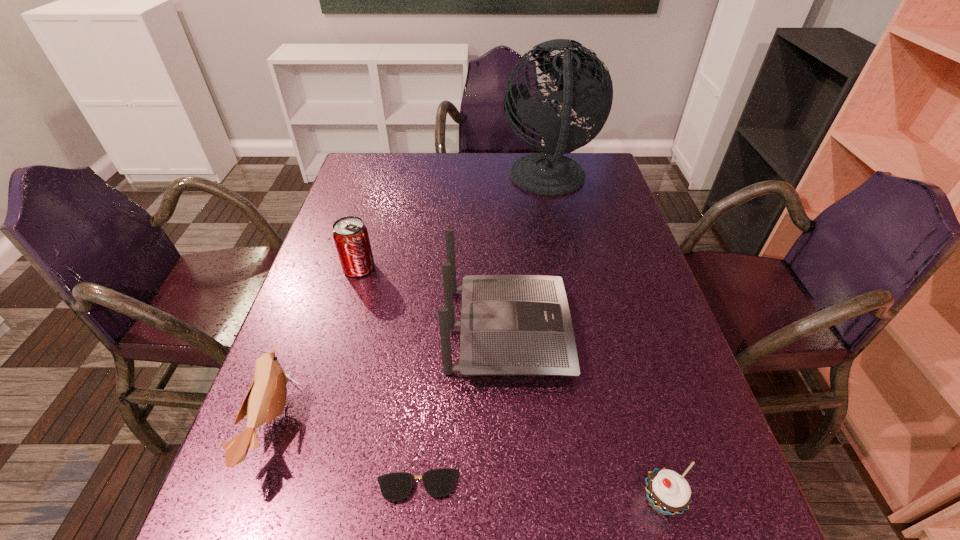
Where is `vacant point located between the cupcake and the shortest object`? The height and width of the screenshot is (540, 960). vacant point located between the cupcake and the shortest object is located at coordinates (540, 494).

In order to click on free space that is in between the tallest object and the leftmost object in this screenshot , I will do `click(411, 302)`.

Where is `vacant area that lies between the fifth tallest object and the spectacles`? This screenshot has width=960, height=540. vacant area that lies between the fifth tallest object and the spectacles is located at coordinates [540, 494].

Identify the location of free area in between the second shortest object and the shortest object. (540, 494).

This screenshot has width=960, height=540. I want to click on empty location between the bird and the spectacles, so click(346, 455).

Where is `free area in between the fifth tallest object and the spectacles`? The height and width of the screenshot is (540, 960). free area in between the fifth tallest object and the spectacles is located at coordinates (540, 494).

You are a GUI agent. You are given a task and a screenshot of the screen. Output one action in this format:
    pyautogui.click(x=<x>, y=<y>)
    Task: Click on the object that is the fifth closest to the shortest object
    The image size is (960, 540).
    Given the screenshot: What is the action you would take?
    pyautogui.click(x=587, y=85)

Select which object is the third closest to the spectacles. Please provide its 2D coordinates. Your answer should be formatted as a tuple, i.e. [(x, y)], where the tuple contains the x and y coordinates of a point satisfying the conditions above.

[(668, 493)]

Identify the location of free location that satisfies the following two spatial constraints: 1. on the back side of the shortest object; 2. on the front-facing side of the second tallest object. This screenshot has width=960, height=540. pyautogui.click(x=433, y=330).

The width and height of the screenshot is (960, 540). Identify the location of blank area in the image that satisfies the following two spatial constraints: 1. on the front-facing side of the tallest object; 2. on the front side of the pop soda. (566, 268).